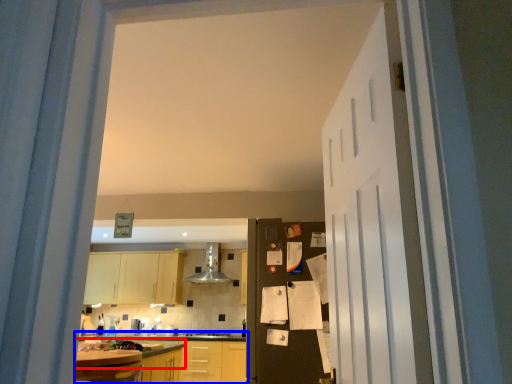
Question: Which object appears closest to the camera in this image, countertop (highlighted by a red box) or countertop (highlighted by a blue box)?

Choices:
 (A) countertop
 (B) countertop

Answer: (A)